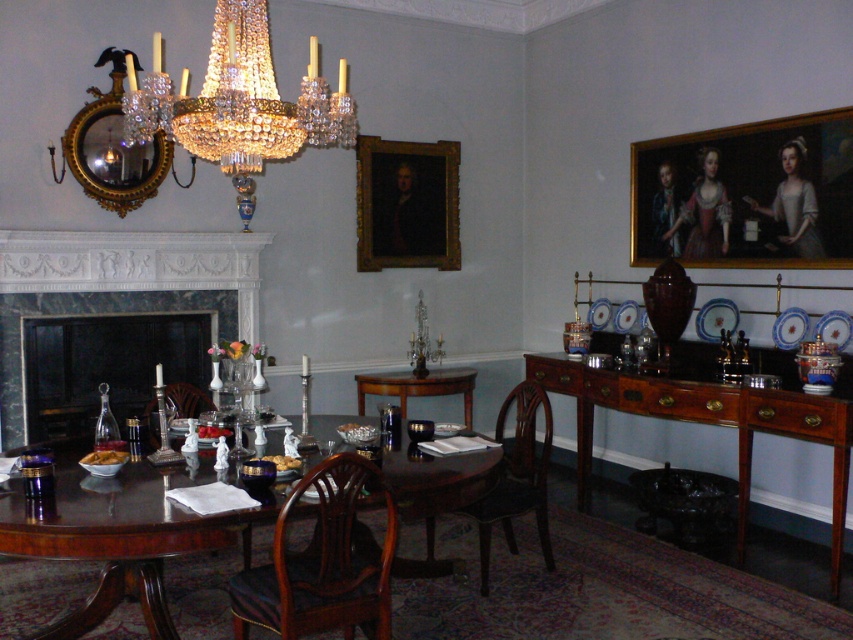
You are a guest at a formal dinner seated at the mahogany wood chair at center. You want to place your napkin on the marble fireplace at center. Is this possible without moving from your seat?

The marble fireplace at center is located above the mahogany wood chair at center, so you cannot reach it from your seated position without moving.

You are a guest entering the dining room and want to sit down at the table. Based on the scene, where should you walk towards to reach the brown wood chair at lower center from the mahogany wood round table at center?

The mahogany wood round table at center is located above the brown wood chair at lower center, so you should walk downwards from the table towards the lower center direction to reach the chair.